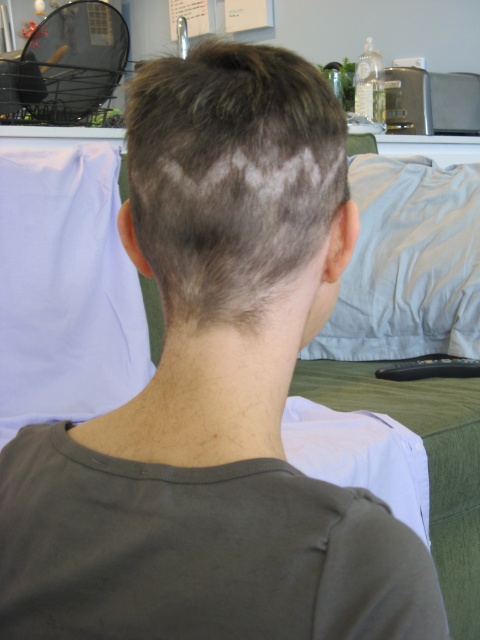
You are a photographer adjusting lighting for a portrait. You notice the dark brown hair at center and the black plastic remote at lower center in the frame. Which object will require more careful lighting to avoid appearing too thin in the photo?

The dark brown hair at center is thinner than the black plastic remote at lower center, so it will require more careful lighting to avoid appearing too thin in the photo.

You are a photographer adjusting the lighting for a portrait. You need to ensure that the dark brown hair at center is properly illuminated. Given that the light source is positioned at point (x=230, y=176), will the light hit the dark brown hair at center effectively?

The dark brown hair at center is represented by point (x=230, y=176), so the light source is positioned exactly at the location of the dark brown hair at center. This means the light will directly illuminate the dark brown hair at center effectively.